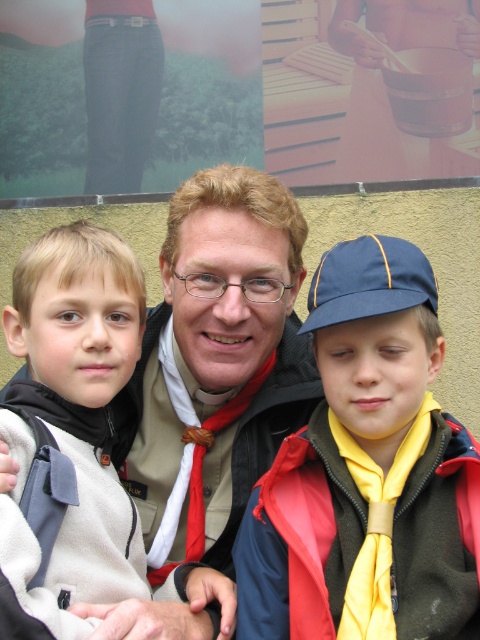
You are standing at the position of the adult male in the center. You want to hand a metallic silver pot at upper center to the boy with light brown hair at left. Can you reach him directly without moving from your current position?

The light brown hair at left is 6.89 meters away from the metallic silver pot at upper center. Since the distance is quite large, you cannot reach the boy directly without moving from your current position.

You are a photographer trying to adjust the lighting for a group photo. You notice the yellow matte scarf at center and the light brown hair at left. Which object is positioned higher in the image?

The yellow matte scarf at center is taller than the light brown hair at left, so it is positioned higher in the image.

You are a photographer trying to adjust the lighting for a group photo. You notice the yellow matte scarf at center and the light brown hair at left. Which object is located lower in the image?

The yellow matte scarf at center is positioned under the light brown hair at left, so it is located lower in the image.